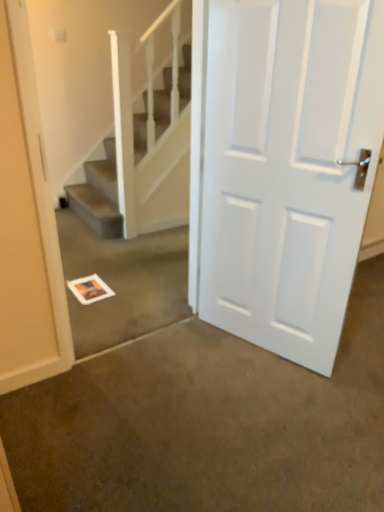
Question: Considering the relative sizes of white paper at center and white matte door at center in the image provided, is white paper at center thinner than white matte door at center?

Choices:
 (A) yes
 (B) no

Answer: (B)

Question: Is white paper at center further to the viewer compared to white matte door at center?

Choices:
 (A) yes
 (B) no

Answer: (A)

Question: Considering the relative sizes of white paper at center and white matte door at center in the image provided, is white paper at center shorter than white matte door at center?

Choices:
 (A) no
 (B) yes

Answer: (B)

Question: Considering the relative positions of white paper at center and white matte door at center in the image provided, is white paper at center to the right of white matte door at center from the viewer's perspective?

Choices:
 (A) no
 (B) yes

Answer: (A)

Question: From the image's perspective, is white paper at center on top of white matte door at center?

Choices:
 (A) no
 (B) yes

Answer: (A)

Question: Does white paper at center have a larger size compared to white matte door at center?

Choices:
 (A) no
 (B) yes

Answer: (A)

Question: Does white matte door at center have a greater width compared to white paper at center?

Choices:
 (A) yes
 (B) no

Answer: (B)

Question: Considering the relative sizes of white matte door at center and white paper at center in the image provided, is white matte door at center shorter than white paper at center?

Choices:
 (A) no
 (B) yes

Answer: (A)

Question: Can you confirm if white matte door at center is positioned to the left of white paper at center?

Choices:
 (A) yes
 (B) no

Answer: (B)

Question: Is white matte door at center thinner than white paper at center?

Choices:
 (A) yes
 (B) no

Answer: (A)

Question: Is white matte door at center aimed at white paper at center?

Choices:
 (A) yes
 (B) no

Answer: (B)

Question: Is white matte door at center at the right side of white paper at center?

Choices:
 (A) yes
 (B) no

Answer: (A)

Question: From the image's perspective, does white paper at center appear lower than white textured stairs at upper center?

Choices:
 (A) yes
 (B) no

Answer: (A)